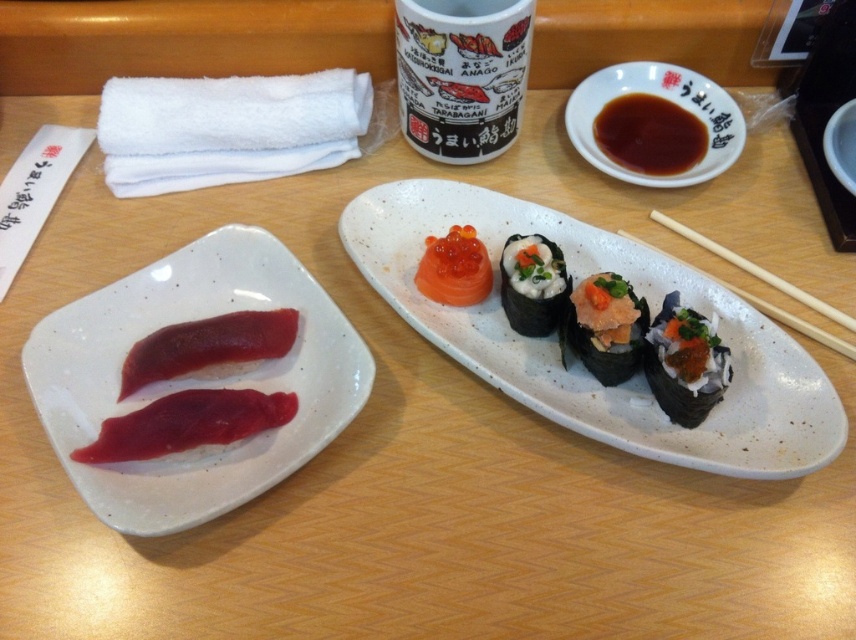
You are a food photographer setting up a shot of the sushi meal. You need to place a small garnish exactly halfway between the square white plate and the brown ceramic bowl at upper right. Where should you place it?

The garnish should be placed halfway between the square white plate and the brown ceramic bowl at upper right. Since the bowl is at point (663, 99), you need to calculate the midpoint between the plate and this coordinate.

You are a waiter who needs to place a 12 inch long tray between the white ceramic cup at upper center and the shiny black sushi at center. Can you fit the tray there?

The distance between the white ceramic cup at upper center and the shiny black sushi at center is 13.73 inches, so yes, the 12 inch long tray can fit in the space between them since it is shorter than the available distance.